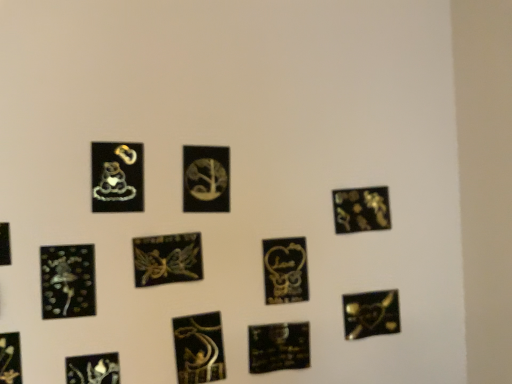
Question: Is metallic gold fairy at center, marked as the sixth picture frame in a left-to-right arrangement, thinner than matte black heart at lower left, which is the 9th picture frame from right to left?

Choices:
 (A) no
 (B) yes

Answer: (A)

Question: Considering the relative sizes of metallic gold fairy at center, the seventh picture frame when ordered from right to left, and matte black heart at lower left, which is the 4th picture frame from left to right, in the image provided, is metallic gold fairy at center, the seventh picture frame when ordered from right to left, taller than matte black heart at lower left, which is the 4th picture frame from left to right,?

Choices:
 (A) yes
 (B) no

Answer: (B)

Question: From the image's perspective, is metallic gold fairy at center, marked as the sixth picture frame in a left-to-right arrangement, over matte black heart at lower left, which is the 9th picture frame from right to left?

Choices:
 (A) yes
 (B) no

Answer: (A)

Question: Considering the relative positions of metallic gold fairy at center, marked as the sixth picture frame in a left-to-right arrangement, and matte black heart at lower left, which is the 9th picture frame from right to left, in the image provided, is metallic gold fairy at center, marked as the sixth picture frame in a left-to-right arrangement, behind matte black heart at lower left, which is the 9th picture frame from right to left,?

Choices:
 (A) no
 (B) yes

Answer: (B)

Question: From a real-world perspective, is metallic gold fairy at center, marked as the sixth picture frame in a left-to-right arrangement, beneath matte black heart at lower left, which is the 4th picture frame from left to right?

Choices:
 (A) yes
 (B) no

Answer: (B)

Question: Considering the relative sizes of metallic gold fairy at center, the seventh picture frame when ordered from right to left, and matte black heart at lower left, which is the 9th picture frame from right to left, in the image provided, is metallic gold fairy at center, the seventh picture frame when ordered from right to left, smaller than matte black heart at lower left, which is the 9th picture frame from right to left,?

Choices:
 (A) yes
 (B) no

Answer: (B)

Question: Considering the relative positions of matte black heart at lower left, which is the 4th picture frame from left to right, and matte gold charm at upper left, placed as the 5th picture frame when sorted from left to right, in the image provided, is matte black heart at lower left, which is the 4th picture frame from left to right, to the left of matte gold charm at upper left, placed as the 5th picture frame when sorted from left to right, from the viewer's perspective?

Choices:
 (A) no
 (B) yes

Answer: (B)

Question: From the image's perspective, would you say matte black heart at lower left, which is the 4th picture frame from left to right, is positioned over matte gold charm at upper left, placed as the 5th picture frame when sorted from left to right?

Choices:
 (A) yes
 (B) no

Answer: (B)

Question: From a real-world perspective, does matte black heart at lower left, which is the 9th picture frame from right to left, sit lower than matte gold charm at upper left, which is counted as the 8th picture frame, starting from the right?

Choices:
 (A) yes
 (B) no

Answer: (A)

Question: Is matte gold charm at upper left, placed as the 5th picture frame when sorted from left to right, surrounded by matte black heart at lower left, which is the 9th picture frame from right to left?

Choices:
 (A) no
 (B) yes

Answer: (A)

Question: Is matte black heart at lower left, which is the 4th picture frame from left to right, in front of matte gold charm at upper left, which is counted as the 8th picture frame, starting from the right?

Choices:
 (A) yes
 (B) no

Answer: (A)

Question: Does matte black heart at lower left, which is the 4th picture frame from left to right, turn towards matte gold charm at upper left, which is counted as the 8th picture frame, starting from the right?

Choices:
 (A) yes
 (B) no

Answer: (B)

Question: Does matte black sticker at upper right, which is the second picture frame from right to left, appear on the right side of matte gold charm at upper left, placed as the 5th picture frame when sorted from left to right?

Choices:
 (A) no
 (B) yes

Answer: (B)